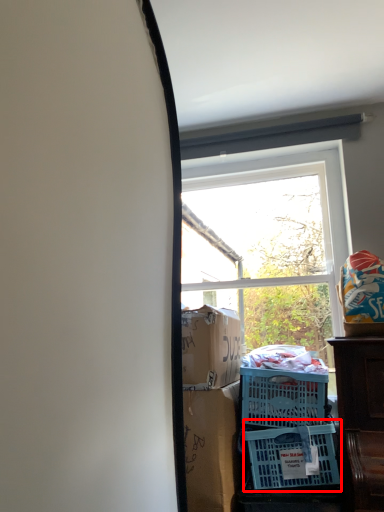
Question: From the image, what is the correct spatial relationship of basket (annotated by the red box) in relation to window?

Choices:
 (A) left
 (B) right

Answer: (A)